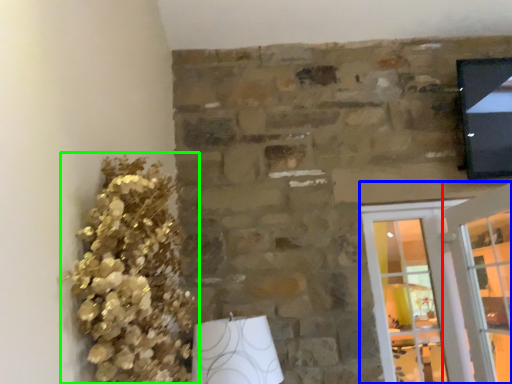
Question: Based on their relative distances, which object is nearer to glass door (highlighted by a red box)? Choose from screen door (highlighted by a blue box) and floral arrangement (highlighted by a green box).

Choices:
 (A) screen door
 (B) floral arrangement

Answer: (A)